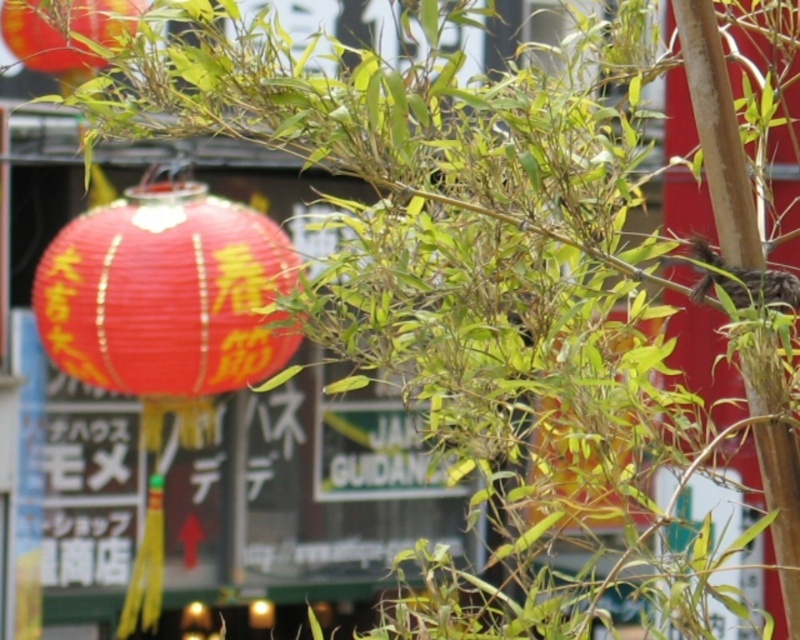
Question: Which object is positioned farthest from the bamboo at center?

Choices:
 (A) matte paper lantern at upper left
 (B) matte paper lantern at center

Answer: (B)

Question: Is matte paper lantern at center closer to the viewer compared to matte paper lantern at upper left?

Choices:
 (A) yes
 (B) no

Answer: (B)

Question: Estimate the real-world distances between objects in this image. Which object is closer to the matte paper lantern at center?

Choices:
 (A) bamboo at center
 (B) matte paper lantern at upper left

Answer: (B)

Question: Can you confirm if bamboo at center is thinner than matte paper lantern at upper left?

Choices:
 (A) yes
 (B) no

Answer: (A)

Question: Which object is farther from the camera taking this photo?

Choices:
 (A) matte paper lantern at upper left
 (B) bamboo at center
 (C) matte paper lantern at center

Answer: (C)

Question: Is bamboo at center smaller than matte paper lantern at upper left?

Choices:
 (A) yes
 (B) no

Answer: (A)